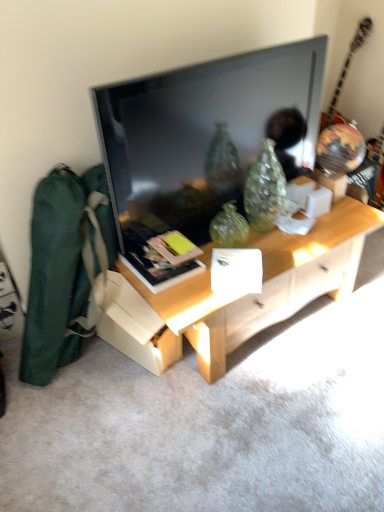
At what (x,y) coordinates should I click in order to perform the action: click on free space in front of green canvas messenger bag at left. Please return your answer as a coordinate pair (x, y). Image resolution: width=384 pixels, height=512 pixels. Looking at the image, I should click on (82, 418).